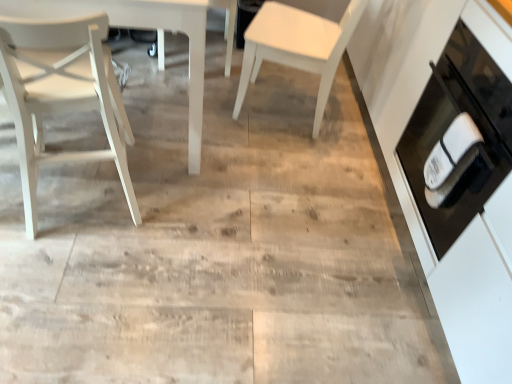
Identify the location of black glass oven at right. The image size is (512, 384). (448, 127).

This screenshot has height=384, width=512. What do you see at coordinates (448, 127) in the screenshot?
I see `black glass oven at right` at bounding box center [448, 127].

What do you see at coordinates (225, 21) in the screenshot? This screenshot has width=512, height=384. I see `white matte chair at center, the second chair in the left-to-right sequence` at bounding box center [225, 21].

Image resolution: width=512 pixels, height=384 pixels. Describe the element at coordinates (297, 46) in the screenshot. I see `white matte chair at center, the 1th chair in the right-to-left sequence` at that location.

This screenshot has width=512, height=384. I want to click on black glass oven at right, so click(x=448, y=127).

Between white matte chair at center, the 1th chair in the right-to-left sequence, and white matte chair at left, which ranks as the first chair in left-to-right order, which one appears on the left side from the viewer's perspective?

Positioned to the left is white matte chair at left, which ranks as the first chair in left-to-right order.

From a real-world perspective, does white matte chair at center, the 1th chair in the right-to-left sequence, stand above white matte chair at left, which ranks as the 3th chair in right-to-left order?

No, from a real-world perspective, white matte chair at center, the 1th chair in the right-to-left sequence, is not on top of white matte chair at left, which ranks as the 3th chair in right-to-left order.

Is white matte chair at center, the 1th chair in the right-to-left sequence, located outside white matte chair at left, which ranks as the first chair in left-to-right order?

Absolutely, white matte chair at center, the 1th chair in the right-to-left sequence, is external to white matte chair at left, which ranks as the first chair in left-to-right order.

Consider the image. Between white matte chair at center, the third chair when ordered from left to right, and white matte chair at left, which ranks as the first chair in left-to-right order, which one has smaller size?

white matte chair at left, which ranks as the first chair in left-to-right order.

Is black glass oven at right positioned with its back to white matte chair at left, which ranks as the 3th chair in right-to-left order?

No, white matte chair at left, which ranks as the 3th chair in right-to-left order, is not at the back of black glass oven at right.

Based on the photo, considering the sizes of objects black glass oven at right and white matte chair at left, which ranks as the 3th chair in right-to-left order, in the image provided, who is smaller, black glass oven at right or white matte chair at left, which ranks as the 3th chair in right-to-left order,?

white matte chair at left, which ranks as the 3th chair in right-to-left order, is smaller.

Looking at this image, does black glass oven at right appear on the right side of white matte chair at left, which ranks as the 3th chair in right-to-left order?

Indeed, black glass oven at right is positioned on the right side of white matte chair at left, which ranks as the 3th chair in right-to-left order.

Is white matte chair at center, the second chair in the left-to-right sequence, oriented away from white matte chair at center, the 1th chair in the right-to-left sequence?

No, white matte chair at center, the second chair in the left-to-right sequence, is not facing away from white matte chair at center, the 1th chair in the right-to-left sequence.

Does white matte chair at center, the second chair in the left-to-right sequence, have a larger size compared to white matte chair at center, the 1th chair in the right-to-left sequence?

No.

Is white matte chair at center, arranged as the second chair when viewed from the right, next to white matte chair at center, the third chair when ordered from left to right, and touching it?

They are not placed beside each other.

Can you tell me how much white matte chair at center, arranged as the second chair when viewed from the right, and white matte chair at center, the 1th chair in the right-to-left sequence, differ in facing direction?

The facing directions of white matte chair at center, arranged as the second chair when viewed from the right, and white matte chair at center, the 1th chair in the right-to-left sequence, are 106 degrees apart.

Is white matte chair at center, the 1th chair in the right-to-left sequence, at the back of white matte chair at left, which ranks as the first chair in left-to-right order?

No, white matte chair at center, the 1th chair in the right-to-left sequence, is not at the back of white matte chair at left, which ranks as the first chair in left-to-right order.

From a real-world perspective, is white matte chair at left, which ranks as the 3th chair in right-to-left order, on top of white matte chair at center, the 1th chair in the right-to-left sequence?

Yes, from a real-world perspective, white matte chair at left, which ranks as the 3th chair in right-to-left order, is above white matte chair at center, the 1th chair in the right-to-left sequence.

Which of these two, white matte chair at left, which ranks as the 3th chair in right-to-left order, or white matte chair at center, the third chair when ordered from left to right, stands taller?

white matte chair at left, which ranks as the 3th chair in right-to-left order.

From the picture: Which of these two, black glass oven at right or white matte chair at center, the 1th chair in the right-to-left sequence, is smaller?

white matte chair at center, the 1th chair in the right-to-left sequence.

Which object is wider, black glass oven at right or white matte chair at center, the third chair when ordered from left to right?

black glass oven at right.

Is point (449, 203) closer to viewer compared to point (345, 38)?

Yes, point (449, 203) is in front of point (345, 38).

Identify the location of the 2nd chair in front of the white matte chair at center, the second chair in the left-to-right sequence, starting your count from the anchor. (61, 94).

Who is taller, white matte chair at center, arranged as the second chair when viewed from the right, or white matte chair at left, which ranks as the 3th chair in right-to-left order?

With more height is white matte chair at left, which ranks as the 3th chair in right-to-left order.

Is white matte chair at center, arranged as the second chair when viewed from the right, facing away from white matte chair at left, which ranks as the 3th chair in right-to-left order?

white matte chair at center, arranged as the second chair when viewed from the right, does not have its back to white matte chair at left, which ranks as the 3th chair in right-to-left order.

How different are the orientations of white matte chair at center, arranged as the second chair when viewed from the right, and white matte chair at left, which ranks as the 3th chair in right-to-left order, in degrees?

The angular difference between white matte chair at center, arranged as the second chair when viewed from the right, and white matte chair at left, which ranks as the 3th chair in right-to-left order, is 168 degrees.

Considering the relative sizes of white matte chair at left, which ranks as the first chair in left-to-right order, and black glass oven at right in the image provided, is white matte chair at left, which ranks as the first chair in left-to-right order, thinner than black glass oven at right?

Indeed, white matte chair at left, which ranks as the first chair in left-to-right order, has a lesser width compared to black glass oven at right.

Is white matte chair at left, which ranks as the first chair in left-to-right order, oriented away from black glass oven at right?

No, white matte chair at left, which ranks as the first chair in left-to-right order,'s orientation is not away from black glass oven at right.

Between white matte chair at left, which ranks as the first chair in left-to-right order, and black glass oven at right, which one has more height?

Standing taller between the two is white matte chair at left, which ranks as the first chair in left-to-right order.

Starting from the white matte chair at left, which ranks as the 3th chair in right-to-left order, which chair is the 1st one behind? Please provide its 2D coordinates.

[(297, 46)]

The width and height of the screenshot is (512, 384). Identify the location of the 3rd chair counting from the left side of the black glass oven at right. (61, 94).

Considering their positions, is white matte chair at center, arranged as the second chair when viewed from the right, positioned closer to white matte chair at center, the third chair when ordered from left to right, than black glass oven at right?

white matte chair at center, arranged as the second chair when viewed from the right, is closer to white matte chair at center, the third chair when ordered from left to right.

Looking at the image, which one is located closer to black glass oven at right, white matte chair at center, arranged as the second chair when viewed from the right, or white matte chair at center, the third chair when ordered from left to right?

white matte chair at center, the third chair when ordered from left to right, is positioned closer to the anchor black glass oven at right.

Based on their spatial positions, is white matte chair at left, which ranks as the 3th chair in right-to-left order, or black glass oven at right further from white matte chair at center, the second chair in the left-to-right sequence?

black glass oven at right lies further to white matte chair at center, the second chair in the left-to-right sequence, than the other object.

In the scene shown: When comparing their distances from white matte chair at center, the third chair when ordered from left to right, does white matte chair at left, which ranks as the first chair in left-to-right order, or white matte chair at center, the second chair in the left-to-right sequence, seem closer?

Among the two, white matte chair at center, the second chair in the left-to-right sequence, is located nearer to white matte chair at center, the third chair when ordered from left to right.

From the image, which object appears to be farther from white matte chair at center, the 1th chair in the right-to-left sequence, white matte chair at left, which ranks as the 3th chair in right-to-left order, or black glass oven at right?

white matte chair at left, which ranks as the 3th chair in right-to-left order, is further to white matte chair at center, the 1th chair in the right-to-left sequence.

Which object lies nearer to the anchor point black glass oven at right, white matte chair at center, the second chair in the left-to-right sequence, or white matte chair at left, which ranks as the 3th chair in right-to-left order?

white matte chair at left, which ranks as the 3th chair in right-to-left order, is closer to black glass oven at right.

When comparing their distances from white matte chair at center, the third chair when ordered from left to right, does black glass oven at right or white matte chair at left, which ranks as the 3th chair in right-to-left order, seem further?

white matte chair at left, which ranks as the 3th chair in right-to-left order, lies further to white matte chair at center, the third chair when ordered from left to right, than the other object.

Considering their positions, is white matte chair at center, the third chair when ordered from left to right, positioned closer to white matte chair at center, arranged as the second chair when viewed from the right, than black glass oven at right?

white matte chair at center, the third chair when ordered from left to right, is closer to white matte chair at center, arranged as the second chair when viewed from the right.

Where is `chair between white matte chair at left, which ranks as the 3th chair in right-to-left order, and white matte chair at center, the second chair in the left-to-right sequence, in the front-back direction`? The width and height of the screenshot is (512, 384). chair between white matte chair at left, which ranks as the 3th chair in right-to-left order, and white matte chair at center, the second chair in the left-to-right sequence, in the front-back direction is located at coordinates (297, 46).

Image resolution: width=512 pixels, height=384 pixels. I want to click on chair between white matte chair at center, arranged as the second chair when viewed from the right, and black glass oven at right, in the horizontal direction, so click(x=297, y=46).